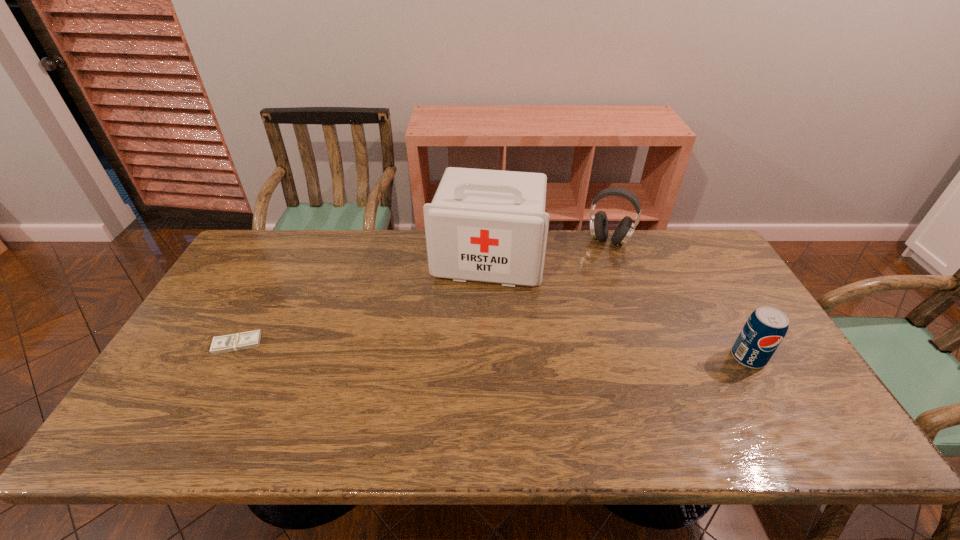
Locate an element on the screen. Image resolution: width=960 pixels, height=540 pixels. vacant spot on the desktop that is between the money and the second shortest object and is positioned on the front-facing side of the second object from left to right is located at coordinates (468, 350).

Where is `vacant space on the desktop that is between the money and the rightmost object and is positioned on the ear cups of the headset`? The height and width of the screenshot is (540, 960). vacant space on the desktop that is between the money and the rightmost object and is positioned on the ear cups of the headset is located at coordinates (552, 352).